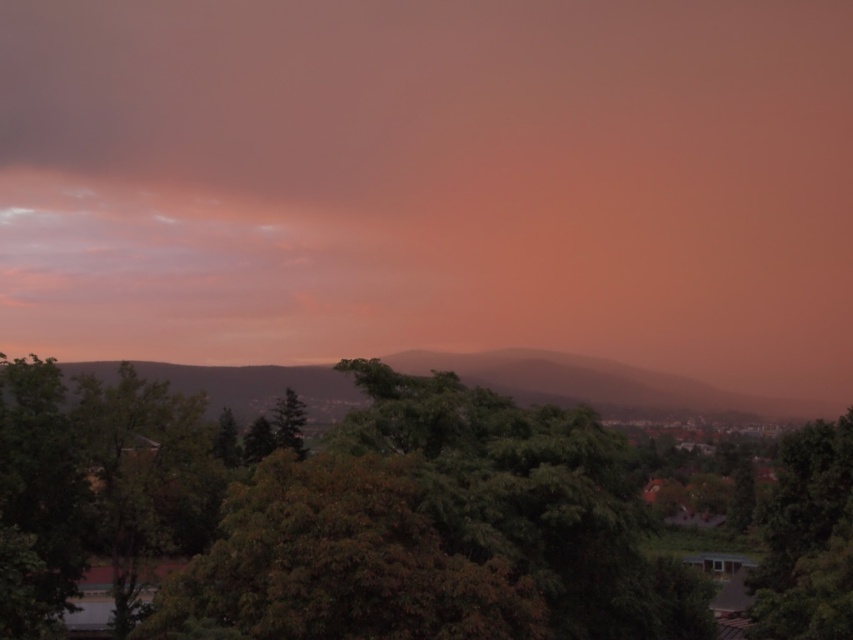
Question: Among these points, which one is nearest to the camera?

Choices:
 (A) (814, 506)
 (B) (321, 636)
 (C) (683, 250)

Answer: (B)

Question: Is pink matte cloud at upper center above green leafy tree at center?

Choices:
 (A) yes
 (B) no

Answer: (A)

Question: Which of the following is the closest to the observer?

Choices:
 (A) (833, 609)
 (B) (189, 80)
 (C) (653, 387)

Answer: (A)

Question: Is green leafy tree at center wider than green matte tree at center?

Choices:
 (A) no
 (B) yes

Answer: (B)

Question: Which is nearer to the green leafy trees at center?

Choices:
 (A) green matte tree at center
 (B) green leafy tree at right

Answer: (A)

Question: Does green leafy trees at center appear on the right side of green matte tree at center?

Choices:
 (A) yes
 (B) no

Answer: (B)